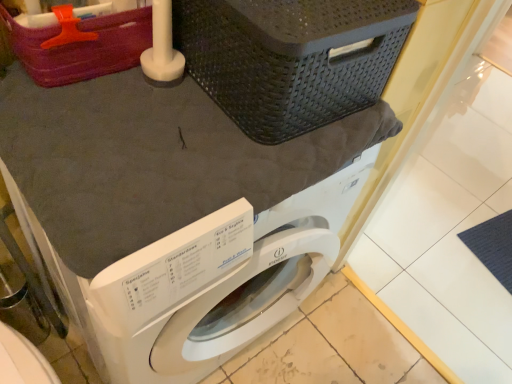
You are a GUI agent. You are given a task and a screenshot of the screen. Output one action in this format:
    pyautogui.click(x=<x>, y=<y>)
    Task: Click on the dark gray woven basket at upper center
    The image size is (512, 384).
    Given the screenshot: What is the action you would take?
    pyautogui.click(x=290, y=58)

The width and height of the screenshot is (512, 384). What do you see at coordinates (290, 58) in the screenshot?
I see `dark gray woven basket at upper center` at bounding box center [290, 58].

Find the location of `dark gray woven basket at upper center`. dark gray woven basket at upper center is located at coordinates (290, 58).